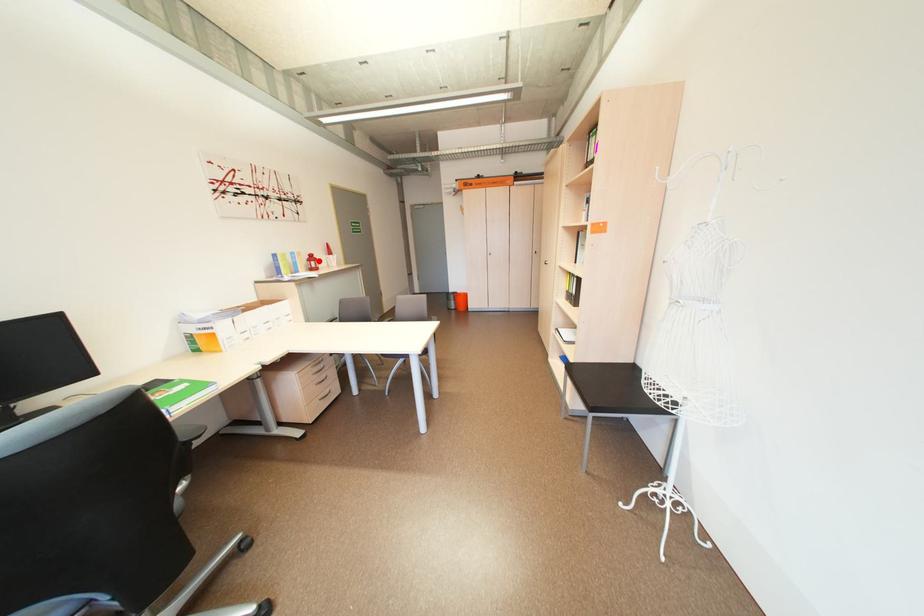
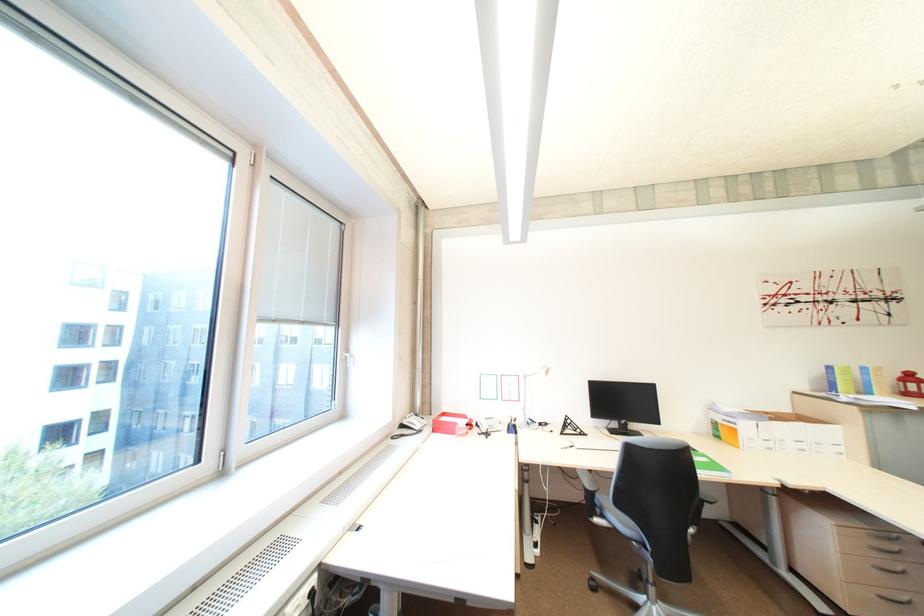
Where in the second image is the point corresponding to the highlighted location from the first image?

(913, 382)